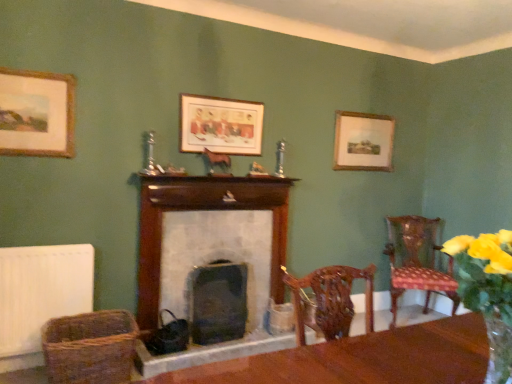
The width and height of the screenshot is (512, 384). Find the location of `free point above smooth wood fireplace at center, acting as the 1th fireplace starting from the top (from a real-world perspective)`. free point above smooth wood fireplace at center, acting as the 1th fireplace starting from the top (from a real-world perspective) is located at coordinates (212, 181).